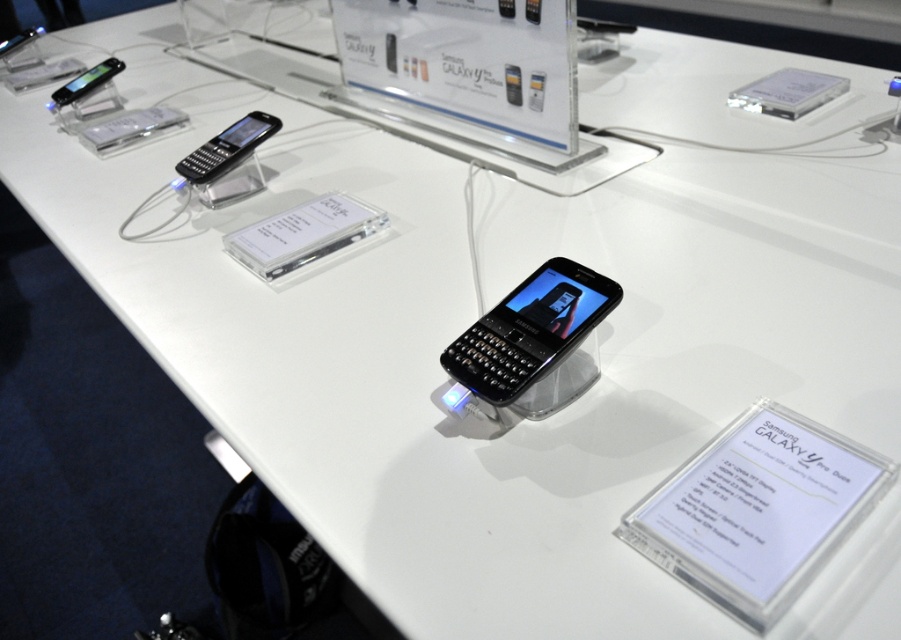
Does black matte keyboard phone at center have a lesser width compared to black glossy phone at upper left?

Indeed, black matte keyboard phone at center has a lesser width compared to black glossy phone at upper left.

Between black matte keyboard phone at center and black glossy phone at upper left, which one appears on the left side from the viewer's perspective?

From the viewer's perspective, black glossy phone at upper left appears more on the left side.

Does point (558, 273) come in front of point (188, 179)?

Yes, it is.

Where is `black matte keyboard phone at center`? The height and width of the screenshot is (640, 901). black matte keyboard phone at center is located at coordinates (535, 340).

Which is above, black glossy phone at upper left or matte black phone at upper left?

matte black phone at upper left

Which is behind, point (175, 168) or point (84, 72)?

Point (84, 72)

Where is `black glossy phone at upper left`? Image resolution: width=901 pixels, height=640 pixels. black glossy phone at upper left is located at coordinates (226, 148).

Does black matte keyboard phone at center have a lesser height compared to matte black phone at upper left?

Incorrect, black matte keyboard phone at center's height does not fall short of matte black phone at upper left's.

Is black matte keyboard phone at center smaller than matte black phone at upper left?

Correct, black matte keyboard phone at center occupies less space than matte black phone at upper left.

Does point (548, 330) come in front of point (123, 61)?

That is True.

Locate an element on the screen. The width and height of the screenshot is (901, 640). black matte keyboard phone at center is located at coordinates (535, 340).